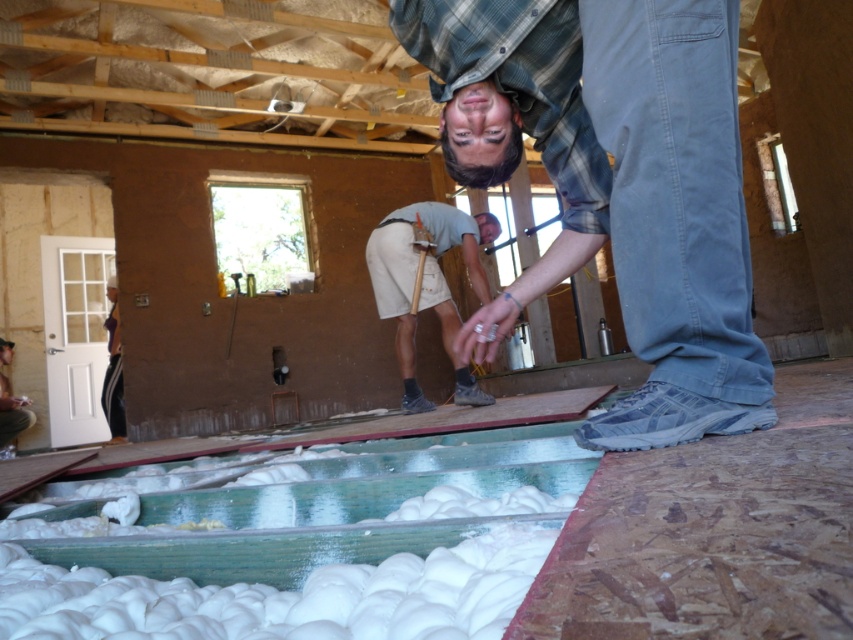
The width and height of the screenshot is (853, 640). In order to click on blue jeans at center in this screenshot , I will do `click(614, 184)`.

Between point (653, 179) and point (492, 225), which one is positioned behind?

The point (492, 225) is more distant.

Is point (640, 35) closer to viewer compared to point (436, 289)?

Yes, point (640, 35) is closer to viewer.

This screenshot has width=853, height=640. I want to click on blue jeans at center, so click(x=614, y=184).

Can you confirm if blue jeans at center is positioned to the right of wooden door at lower left?

Indeed, blue jeans at center is positioned on the right side of wooden door at lower left.

Which of these two, blue jeans at center or wooden door at lower left, stands shorter?

With less height is wooden door at lower left.

Between point (555, 120) and point (19, 432), which one is positioned in front?

Point (555, 120)

This screenshot has height=640, width=853. Identify the location of blue jeans at center. (614, 184).

Measure the distance between blue jeans at center and black fabric at left.

A distance of 5.30 meters exists between blue jeans at center and black fabric at left.

From the picture: Can you confirm if blue jeans at center is taller than black fabric at left?

No, blue jeans at center is not taller than black fabric at left.

Does point (679, 292) come farther from viewer compared to point (115, 296)?

No, it is in front of (115, 296).

Find the location of a particular element. The width and height of the screenshot is (853, 640). blue jeans at center is located at coordinates (614, 184).